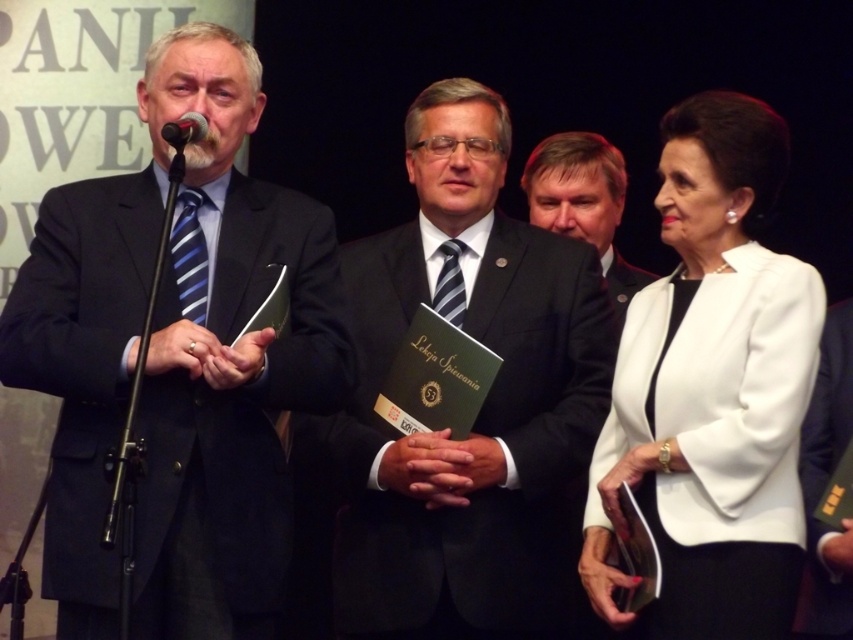
Based on the photo, which is more to the left, matte black suit at center or dark suit at center?

Positioned to the left is matte black suit at center.

This screenshot has height=640, width=853. Identify the location of matte black suit at center. (482, 404).

Does matte black suit at center have a greater width compared to white matte blazer at center?

Indeed, matte black suit at center has a greater width compared to white matte blazer at center.

Does point (460, 582) lie in front of point (695, 572)?

No, it is not.

Does point (579, 333) lie behind point (723, 355)?

Yes, point (579, 333) is farther from viewer.

This screenshot has height=640, width=853. I want to click on matte black suit at center, so click(482, 404).

The height and width of the screenshot is (640, 853). What do you see at coordinates (178, 360) in the screenshot? I see `matte black suit at left` at bounding box center [178, 360].

Which of these two, matte black suit at left or black metallic microphone at upper left, stands shorter?

black metallic microphone at upper left

Where is `matte black suit at left`? The height and width of the screenshot is (640, 853). matte black suit at left is located at coordinates (178, 360).